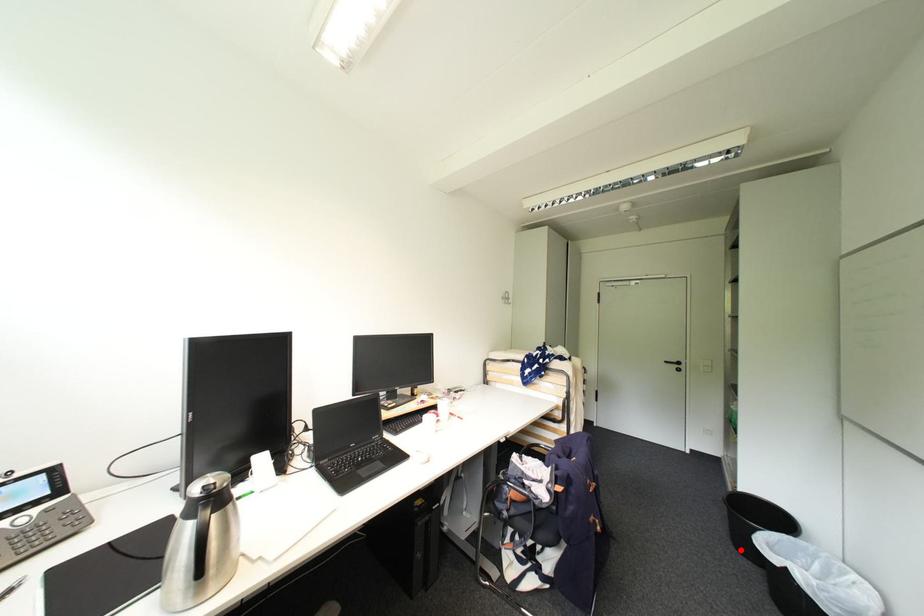
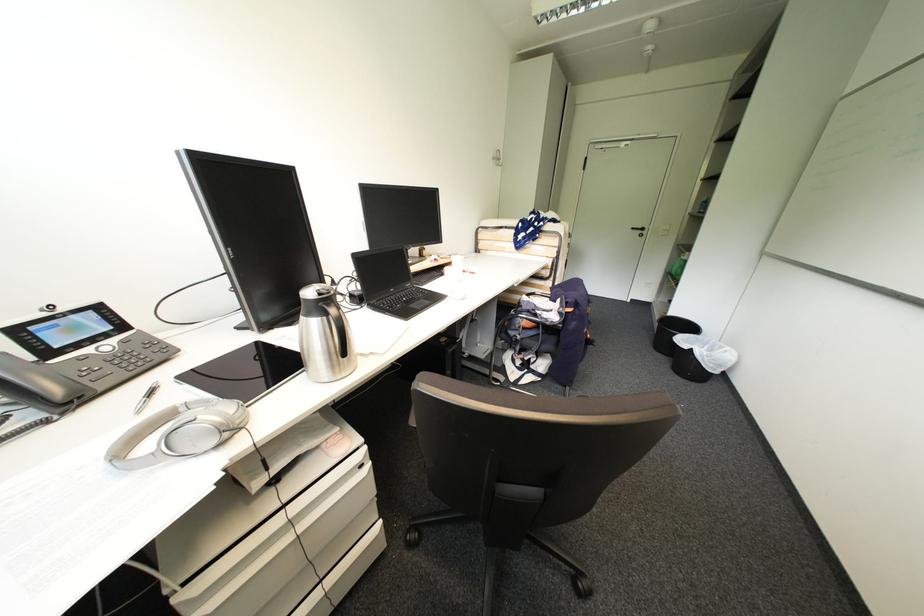
Question: A red point is marked in image1. In image2, is the corresponding 3D point closer to the camera or farther? Reply with the corresponding letter.

Choices:
 (A) The corresponding 3D point is closer.
 (B) The corresponding 3D point is farther.

Answer: (A)